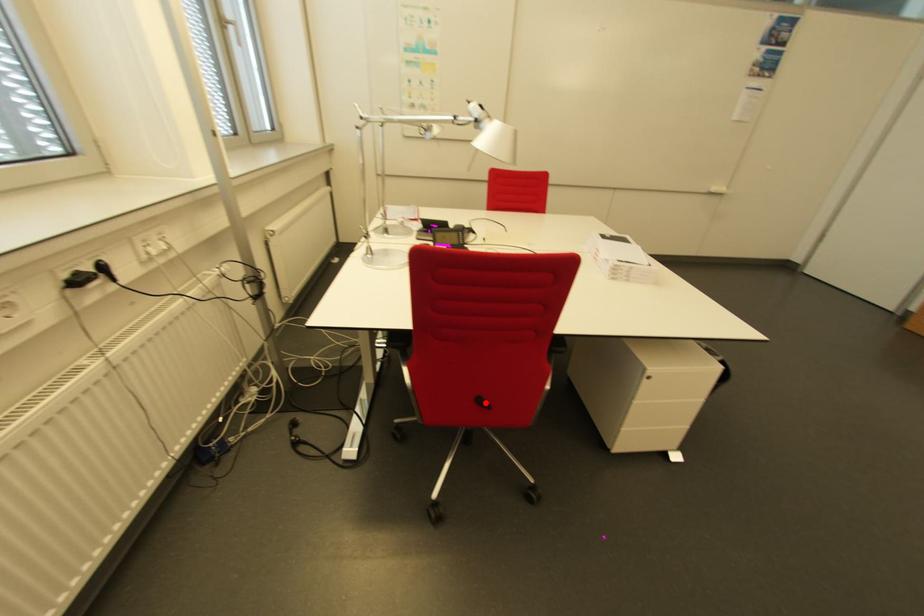
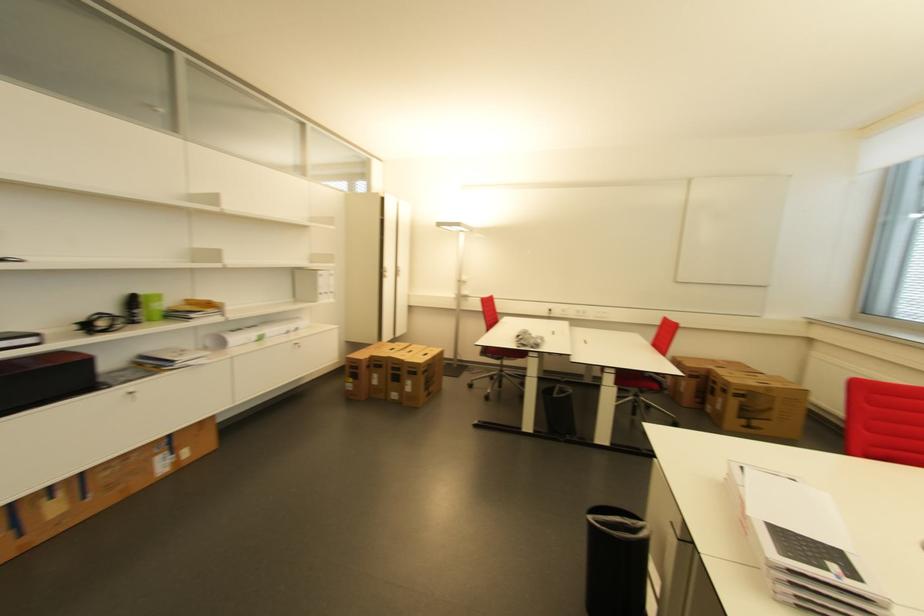
Question: I am providing you with two images of the same scene from different viewpoints. A red point is marked on the first image. Can you still see the location of the red point in image 2?

Choices:
 (A) Yes
 (B) No

Answer: (B)